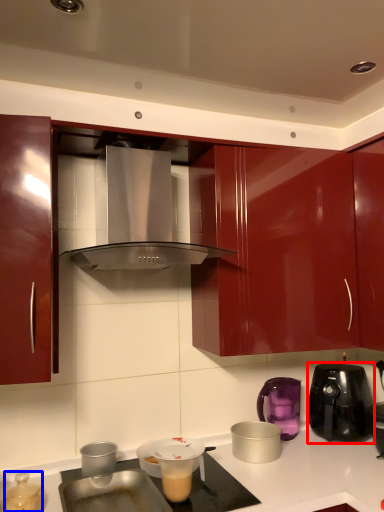
Question: Which object appears closest to the camera in this image, kitchen appliance (highlighted by a red box) or kitchen appliance (highlighted by a blue box)?

Choices:
 (A) kitchen appliance
 (B) kitchen appliance

Answer: (B)